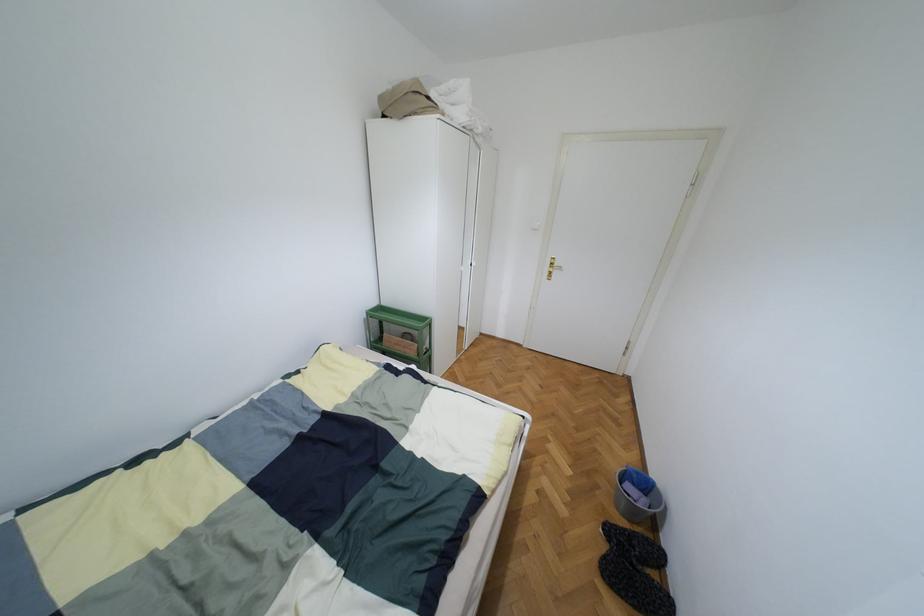
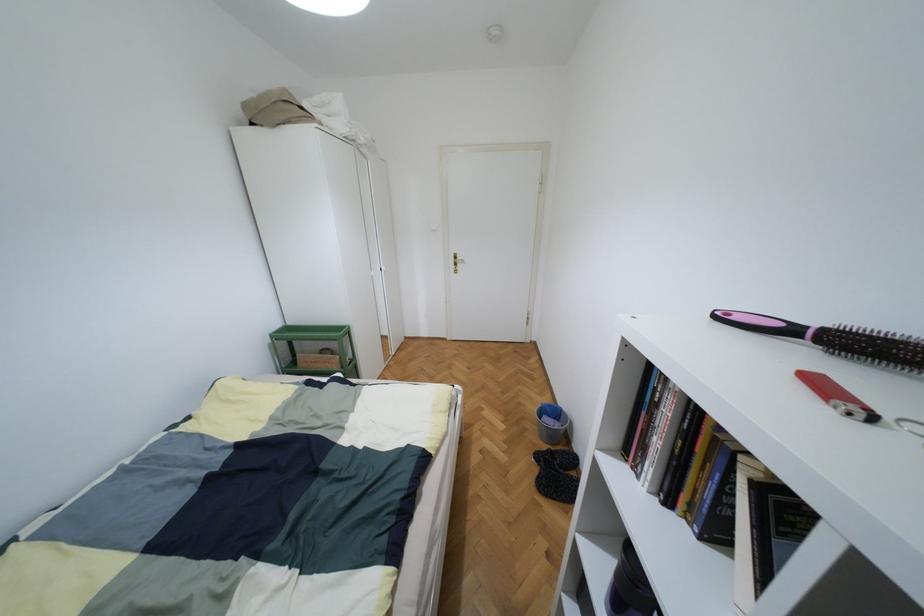
Locate, in the second image, the point that corresponds to point (638, 472) in the first image.

(549, 406)